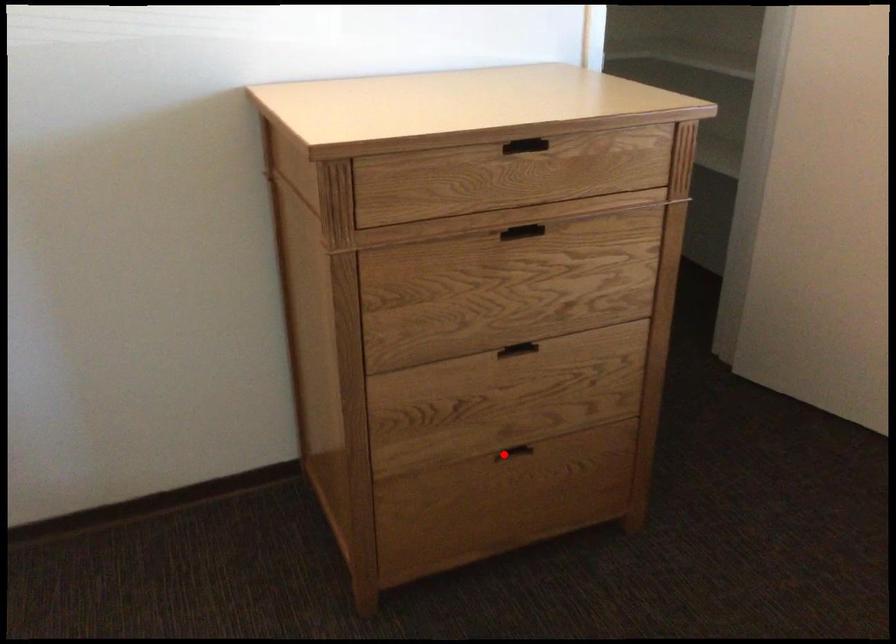
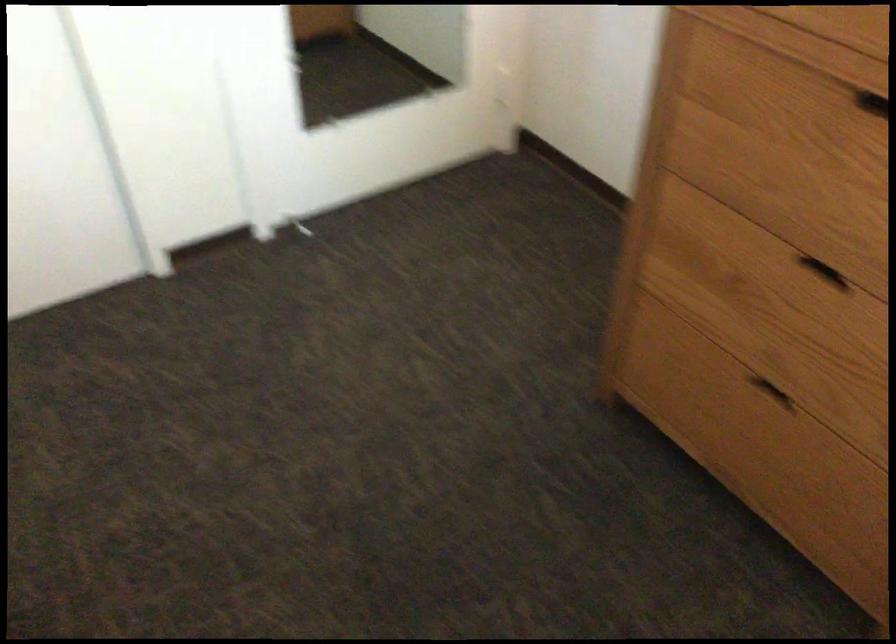
Find the pixel in the second image that matches the highlighted location in the first image.

(770, 392)